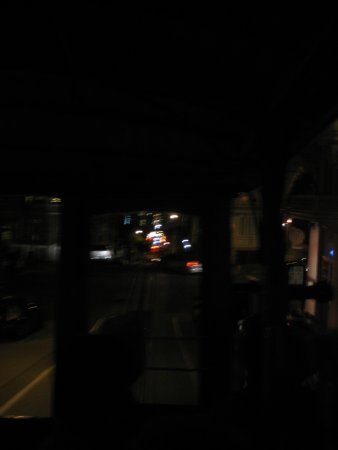
This screenshot has width=338, height=450. Identify the location of window. (177, 300), (177, 379), (177, 348).